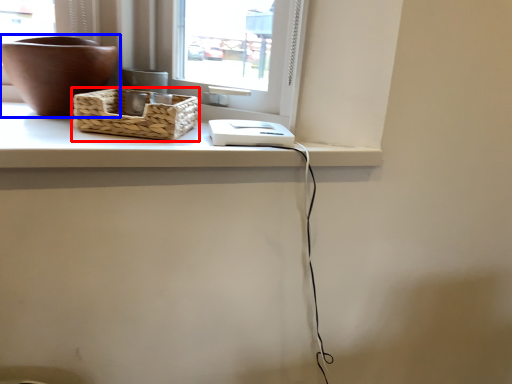
Question: Which object is closer to the camera taking this photo, picnic basket (highlighted by a red box) or flowerpot (highlighted by a blue box)?

Choices:
 (A) picnic basket
 (B) flowerpot

Answer: (A)